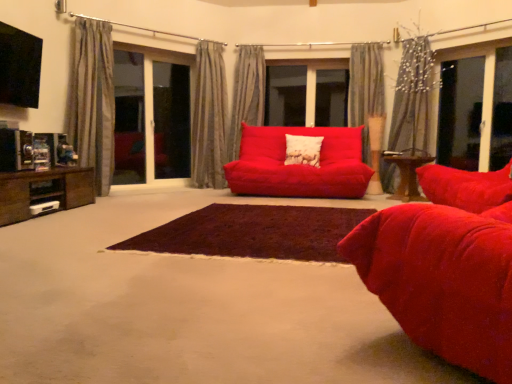
Question: Is matte red couch at center far from transparent glass screen door at left, marked as the second screen door in a right-to-left arrangement?

Choices:
 (A) no
 (B) yes

Answer: (B)

Question: Considering the relative sizes of matte red couch at center and transparent glass screen door at left, which is the first screen door from left to right, in the image provided, is matte red couch at center wider than transparent glass screen door at left, which is the first screen door from left to right,?

Choices:
 (A) no
 (B) yes

Answer: (B)

Question: From a real-world perspective, is matte red couch at center located beneath transparent glass screen door at left, marked as the second screen door in a right-to-left arrangement?

Choices:
 (A) no
 (B) yes

Answer: (B)

Question: Does matte red couch at center appear on the left side of transparent glass screen door at left, which is the first screen door from left to right?

Choices:
 (A) no
 (B) yes

Answer: (A)

Question: Does matte red couch at center have a lesser height compared to transparent glass screen door at left, which is the first screen door from left to right?

Choices:
 (A) no
 (B) yes

Answer: (B)

Question: Relative to wooden table at center, positioned as the second table in left-to-right order, is gray textured curtain at left, the 5th curtain when ordered from right to left, in front or behind?

Choices:
 (A) front
 (B) behind

Answer: (A)

Question: Choose the correct answer: Is gray textured curtain at left, marked as the first curtain in a left-to-right arrangement, inside wooden table at center, which is counted as the 2th table, starting from the front, or outside it?

Choices:
 (A) outside
 (B) inside

Answer: (A)

Question: Based on their positions, is gray textured curtain at left, marked as the first curtain in a left-to-right arrangement, located to the left or right of wooden table at center, positioned as the second table in left-to-right order?

Choices:
 (A) left
 (B) right

Answer: (A)

Question: Does point (93, 127) appear closer or farther from the camera than point (409, 185)?

Choices:
 (A) closer
 (B) farther

Answer: (A)

Question: Visually, is satin gray curtain at center, acting as the 3th curtain starting from the left, positioned to the left or to the right of gray textured curtain at left, marked as the first curtain in a left-to-right arrangement?

Choices:
 (A) right
 (B) left

Answer: (A)

Question: Considering the positions of satin gray curtain at center, acting as the 3th curtain starting from the left, and gray textured curtain at left, the 5th curtain when ordered from right to left, in the image, is satin gray curtain at center, acting as the 3th curtain starting from the left, taller or shorter than gray textured curtain at left, the 5th curtain when ordered from right to left,?

Choices:
 (A) tall
 (B) short

Answer: (B)

Question: From a real-world perspective, relative to gray textured curtain at left, marked as the first curtain in a left-to-right arrangement, is satin gray curtain at center, acting as the 3th curtain starting from the left, vertically above or below?

Choices:
 (A) below
 (B) above

Answer: (B)

Question: Is satin gray curtain at center, acting as the 3th curtain starting from the left, in front of or behind gray textured curtain at left, marked as the first curtain in a left-to-right arrangement, in the image?

Choices:
 (A) front
 (B) behind

Answer: (B)

Question: Considering the positions of dark brown shaggy rug at center and transparent glass screen door at left, which is the first screen door from left to right, in the image, is dark brown shaggy rug at center bigger or smaller than transparent glass screen door at left, which is the first screen door from left to right,?

Choices:
 (A) small
 (B) big

Answer: (A)

Question: Considering the positions of dark brown shaggy rug at center and transparent glass screen door at left, marked as the second screen door in a right-to-left arrangement, in the image, is dark brown shaggy rug at center wider or thinner than transparent glass screen door at left, marked as the second screen door in a right-to-left arrangement,?

Choices:
 (A) thin
 (B) wide

Answer: (B)